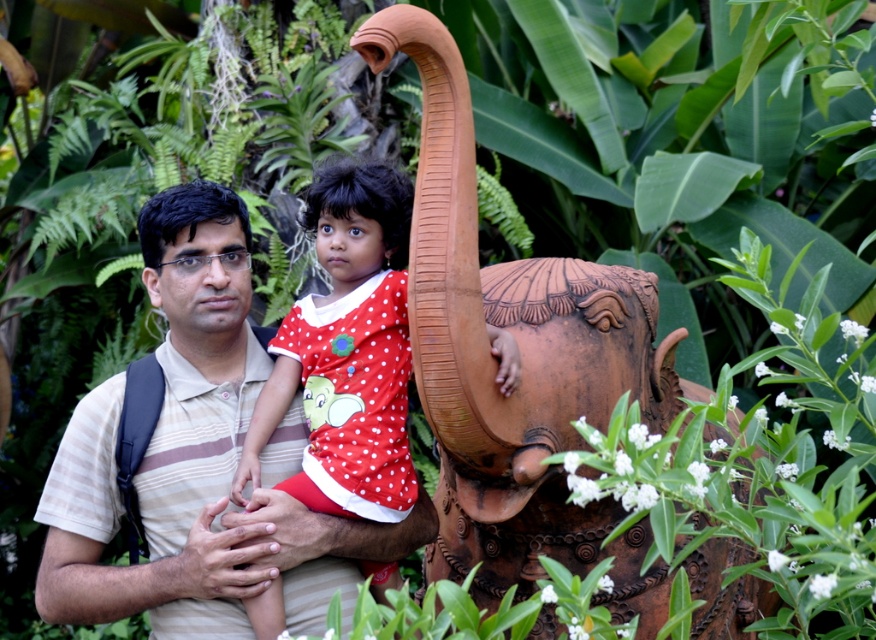
You are a photographer setting up a shot of the striped cotton shirt at center and the polka dot fabric dress at center. The camera has a maximum focus range of 30 inches. Can you capture both subjects in focus without adjusting the camera settings?

The striped cotton shirt at center is 32.97 inches from the polka dot fabric dress at center, which exceeds the camera maximum focus range of 30 inches. Therefore, you need to adjust the camera settings to ensure both are in focus.

In the scene, there is a terracotta elephant at center and a striped cotton shirt at center. Which object is taller?

The terracotta elephant at center is taller than the striped cotton shirt at center.